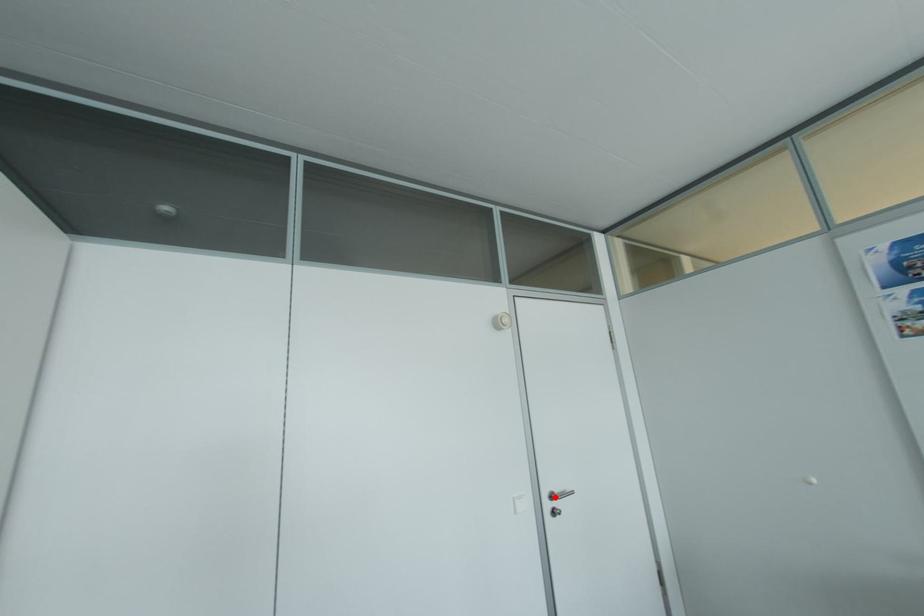
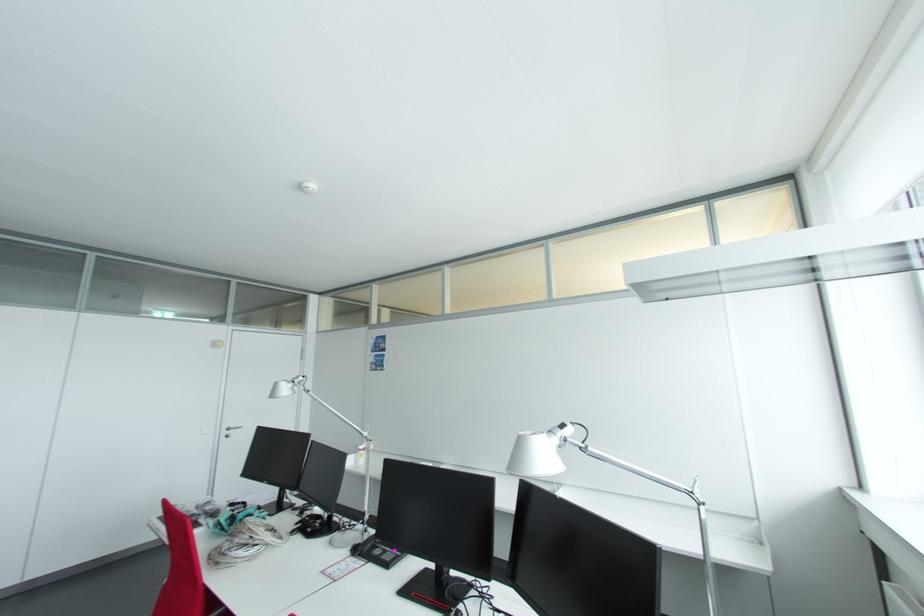
The point at the highlighted location is marked in the first image. Where is the corresponding point in the second image?

(232, 430)